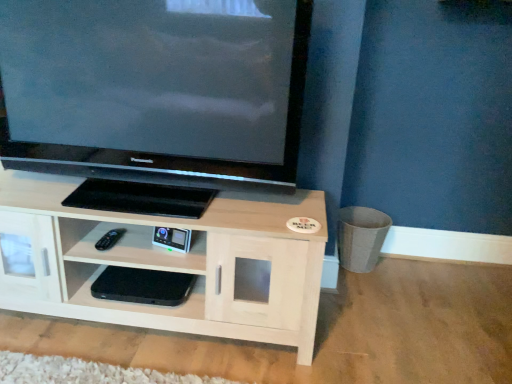
At what (x,y) coordinates should I click in order to perform the action: click on vacant space to the right of light wood shelf at center, the first shelf from the top. Please return your answer as a coordinate pair (x, y). The image size is (512, 384). Looking at the image, I should click on (381, 325).